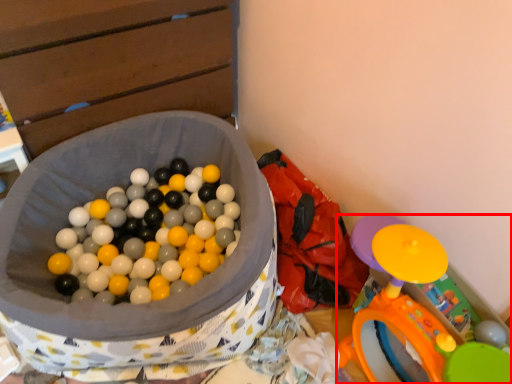
Question: From the image's perspective, where is toy (annotated by the red box) located in relation to bean bag chair in the image?

Choices:
 (A) below
 (B) above

Answer: (A)